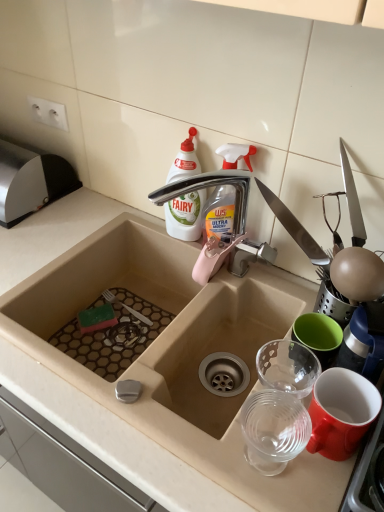
You are a GUI agent. You are given a task and a screenshot of the screen. Output one action in this format:
    pyautogui.click(x=<x>, y=<y>)
    Task: Click on the free spot to the left of transparent plastic cups at right
    Image resolution: width=384 pixels, height=512 pixels.
    Given the screenshot: What is the action you would take?
    pyautogui.click(x=184, y=429)